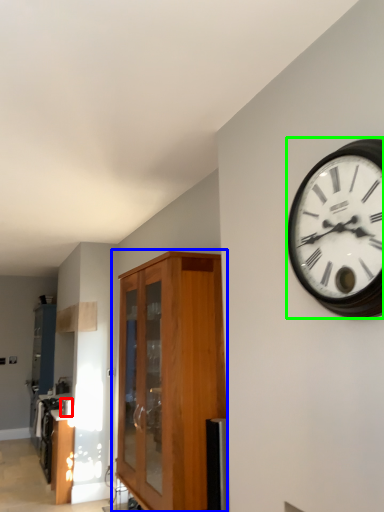
Question: Which is nearer to the appliance (highlighted by a red box)? cabinetry (highlighted by a blue box) or wall clock (highlighted by a green box).

Choices:
 (A) cabinetry
 (B) wall clock

Answer: (A)